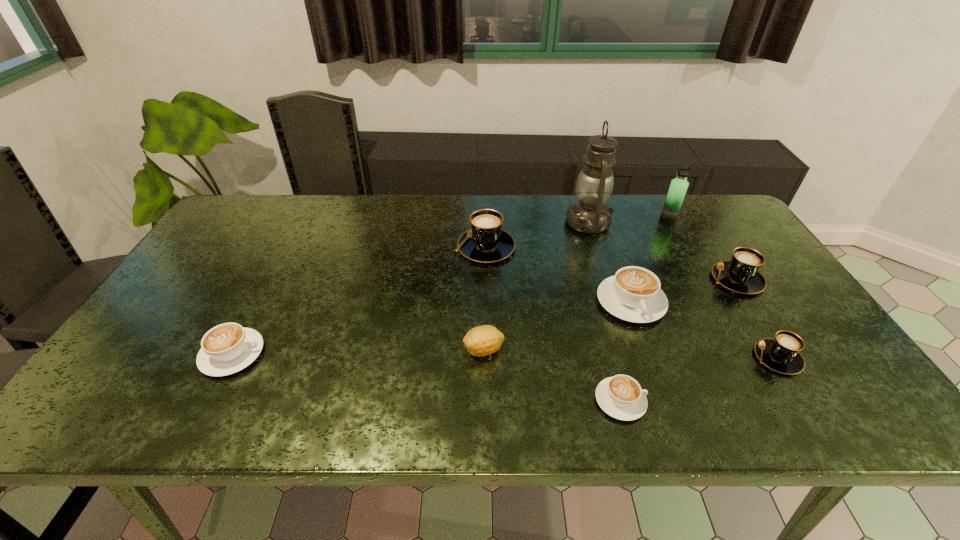
At what (x,y) coordinates should I click in order to perform the action: click on the tallest object. Please return your answer as a coordinate pair (x, y). Looking at the image, I should click on (590, 215).

I want to click on thermos bottle, so click(678, 187).

The image size is (960, 540). Identify the location of the second cappuccino from left to right. (486, 242).

The height and width of the screenshot is (540, 960). Find the location of `the leftmost black cappuccino`. the leftmost black cappuccino is located at coordinates (486, 242).

Where is `the second biggest black cappuccino`? Image resolution: width=960 pixels, height=540 pixels. the second biggest black cappuccino is located at coordinates (740, 274).

This screenshot has width=960, height=540. I want to click on the farthest white cappuccino, so click(633, 294).

At what (x,y) coordinates should I click in order to perform the action: click on lemon. Please return your answer as a coordinate pair (x, y). This screenshot has height=540, width=960. Looking at the image, I should click on (483, 340).

Identify the location of the smallest black cappuccino. (781, 354).

The height and width of the screenshot is (540, 960). What are the coordinates of `the leftmost white cappuccino` in the screenshot? It's located at (227, 348).

The image size is (960, 540). Find the location of `the second biggest white cappuccino`. the second biggest white cappuccino is located at coordinates (227, 348).